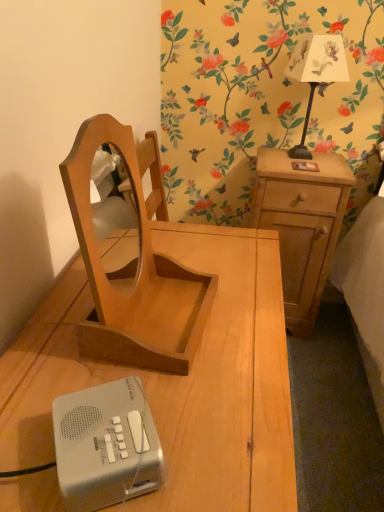
Find the location of a particular element. vacant region to the left of silver plastic radio at lower left is located at coordinates (27, 430).